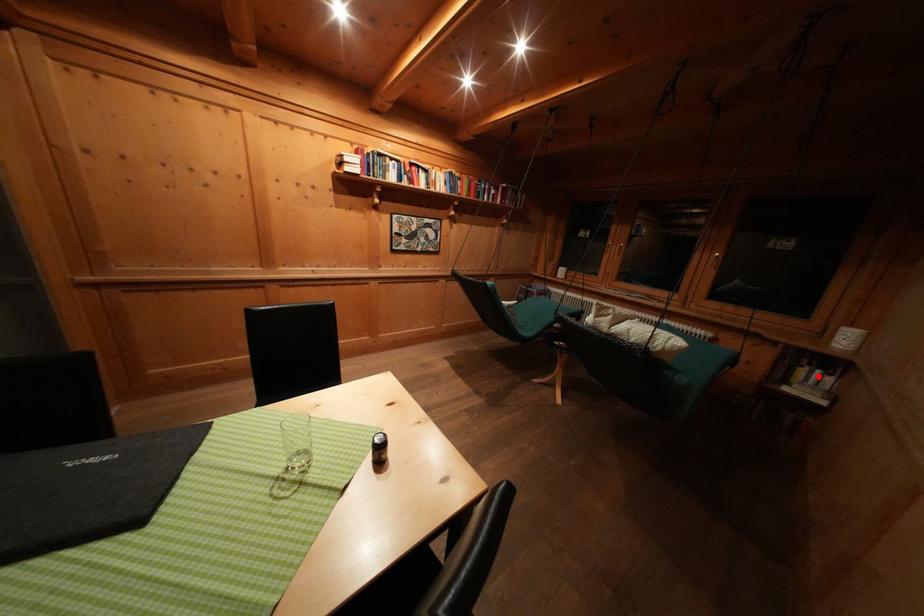
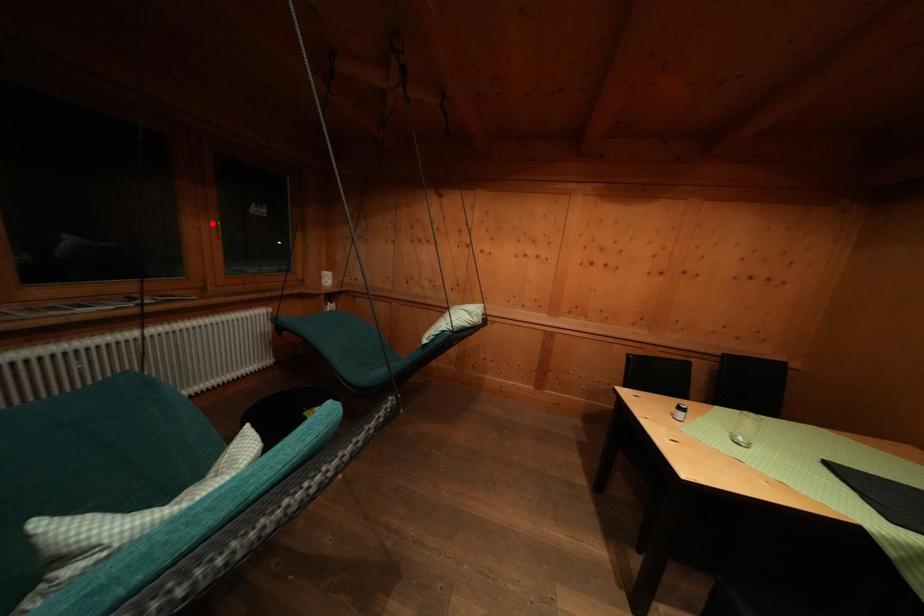
I am providing you with two images of the same scene from different viewpoints. A red point is marked on the first image and another point is marked on the second image. Is the red point in image1 aligned with the point shown in image2?

No